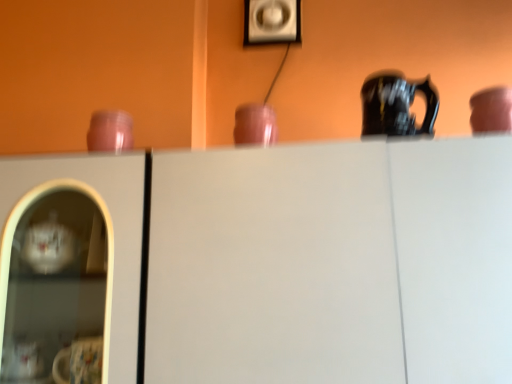
Question: Is matte pink cup at center, acting as the second tableware starting from the right, located within matte plastic picture frame at upper center?

Choices:
 (A) no
 (B) yes

Answer: (A)

Question: Is matte plastic picture frame at upper center outside of matte pink cup at center, acting as the second tableware starting from the right?

Choices:
 (A) yes
 (B) no

Answer: (A)

Question: Considering the relative sizes of matte plastic picture frame at upper center and matte pink cup at center, acting as the second tableware starting from the right, in the image provided, is matte plastic picture frame at upper center wider than matte pink cup at center, acting as the second tableware starting from the right,?

Choices:
 (A) no
 (B) yes

Answer: (A)

Question: Is matte plastic picture frame at upper center thinner than matte pink cup at center, positioned as the second tableware in left-to-right order?

Choices:
 (A) no
 (B) yes

Answer: (B)

Question: Is matte plastic picture frame at upper center next to matte pink cup at center, positioned as the second tableware in left-to-right order?

Choices:
 (A) no
 (B) yes

Answer: (A)

Question: Does matte plastic picture frame at upper center appear on the right side of matte pink cup at center, positioned as the second tableware in left-to-right order?

Choices:
 (A) no
 (B) yes

Answer: (B)

Question: Is matte pink cup at upper right, which appears as the 1th tableware when viewed from the right, positioned with its back to matte plastic picture frame at upper center?

Choices:
 (A) no
 (B) yes

Answer: (A)

Question: Is the depth of matte pink cup at upper right, which appears as the 1th tableware when viewed from the right, greater than that of matte plastic picture frame at upper center?

Choices:
 (A) yes
 (B) no

Answer: (B)

Question: Is matte pink cup at upper right, placed as the 3th tableware when sorted from left to right, closer to the viewer compared to matte plastic picture frame at upper center?

Choices:
 (A) no
 (B) yes

Answer: (B)

Question: Is matte pink cup at upper right, which appears as the 1th tableware when viewed from the right, taller than matte plastic picture frame at upper center?

Choices:
 (A) no
 (B) yes

Answer: (A)

Question: Is the surface of matte pink cup at upper right, which appears as the 1th tableware when viewed from the right, in direct contact with matte plastic picture frame at upper center?

Choices:
 (A) yes
 (B) no

Answer: (B)

Question: From the image's perspective, is matte pink cup at upper right, placed as the 3th tableware when sorted from left to right, on top of matte plastic picture frame at upper center?

Choices:
 (A) yes
 (B) no

Answer: (B)

Question: From the image's perspective, is matte pink cup at upper right, which appears as the 1th tableware when viewed from the right, over white matte cabinet at center?

Choices:
 (A) yes
 (B) no

Answer: (A)